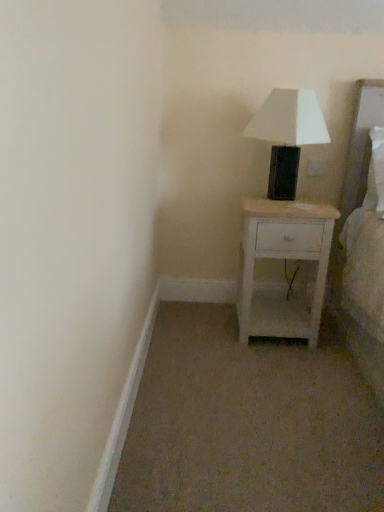
This screenshot has width=384, height=512. In order to click on vacant area that is in front of white wood nightstand at center in this screenshot , I will do `click(292, 370)`.